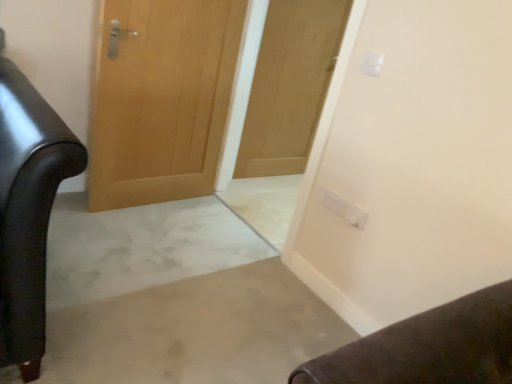
What do you see at coordinates (356, 217) in the screenshot?
I see `white plastic electric outlet at upper right, acting as the 2th electric outlet starting from the back` at bounding box center [356, 217].

Image resolution: width=512 pixels, height=384 pixels. What do you see at coordinates (372, 63) in the screenshot?
I see `white plastic electric outlet at upper center, marked as the third electric outlet in a bottom-to-top arrangement` at bounding box center [372, 63].

You are a GUI agent. You are given a task and a screenshot of the screen. Output one action in this format:
    pyautogui.click(x=<x>, y=<y>)
    Task: Click on the white plastic electric outlet at upper right, the 2th electric outlet in the bottom-to-top sequence
    
    Given the screenshot: What is the action you would take?
    pyautogui.click(x=334, y=203)

From the white plastic electric outlet at upper center, marked as the first electric outlet in a top-to-bottom arrangement, count the 1st door to the left and point to it. Please provide its 2D coordinates.

[(290, 85)]

Can you confirm if white plastic electric outlet at upper center, marked as the third electric outlet in a bottom-to-top arrangement, is smaller than wooden door at center, which is the second door in left-to-right order?

Yes.

Considering the positions of point (373, 69) and point (295, 127), is point (373, 69) closer or farther from the camera than point (295, 127)?

Point (373, 69).

From a real-world perspective, count 1st electric outlets downward from the wooden door at center, the first door from the right, and point to it. Please provide its 2D coordinates.

[(356, 217)]

Is white plastic electric outlet at upper right, marked as the third electric outlet in a top-to-bottom arrangement, beside wooden door at center, the first door from the right?

No, white plastic electric outlet at upper right, marked as the third electric outlet in a top-to-bottom arrangement, is not touching wooden door at center, the first door from the right.

Is white plastic electric outlet at upper center, marked as the third electric outlet in a bottom-to-top arrangement, completely or partially outside of wooden door at center, which is the 1th door in left-to-right order?

Indeed, white plastic electric outlet at upper center, marked as the third electric outlet in a bottom-to-top arrangement, is completely outside wooden door at center, which is the 1th door in left-to-right order.

From the white plastic electric outlet at upper center, marked as the third electric outlet in a bottom-to-top arrangement, count the 2nd door to the left and point to it. Please provide its 2D coordinates.

[(161, 99)]

Does white plastic electric outlet at upper center, placed as the 3th electric outlet when sorted from back to front, appear on the right side of wooden door at center, which is the 1th door in left-to-right order?

Yes.

Are white plastic electric outlet at upper center, placed as the 3th electric outlet when sorted from back to front, and wooden door at center, the second door positioned from the right, far apart?

Yes, white plastic electric outlet at upper center, placed as the 3th electric outlet when sorted from back to front, is far from wooden door at center, the second door positioned from the right.

Can you confirm if wooden door at center, which is the 1th door in left-to-right order, is shorter than white plastic electric outlet at upper right, arranged as the 2th electric outlet when viewed from the top?

In fact, wooden door at center, which is the 1th door in left-to-right order, may be taller than white plastic electric outlet at upper right, arranged as the 2th electric outlet when viewed from the top.

Does point (129, 171) lie in front of point (335, 210)?

No, (129, 171) is behind (335, 210).

In the scene shown: Would you say wooden door at center, which is the 1th door in left-to-right order, is a long distance from white plastic electric outlet at upper right, the 2th electric outlet in the bottom-to-top sequence?

That's right, there is a large distance between wooden door at center, which is the 1th door in left-to-right order, and white plastic electric outlet at upper right, the 2th electric outlet in the bottom-to-top sequence.

Is white plastic electric outlet at upper right, marked as the third electric outlet in a top-to-bottom arrangement, in front of or behind white plastic electric outlet at upper center, placed as the 3th electric outlet when sorted from back to front, in the image?

white plastic electric outlet at upper right, marked as the third electric outlet in a top-to-bottom arrangement, is positioned farther from the viewer than white plastic electric outlet at upper center, placed as the 3th electric outlet when sorted from back to front.

Can you confirm if white plastic electric outlet at upper right, acting as the 2th electric outlet starting from the back, is bigger than white plastic electric outlet at upper center, marked as the third electric outlet in a bottom-to-top arrangement?

Yes, white plastic electric outlet at upper right, acting as the 2th electric outlet starting from the back, is bigger than white plastic electric outlet at upper center, marked as the third electric outlet in a bottom-to-top arrangement.

How many degrees apart are the facing directions of white plastic electric outlet at upper right, marked as the third electric outlet in a top-to-bottom arrangement, and white plastic electric outlet at upper center, placed as the 3th electric outlet when sorted from back to front?

The facing directions of white plastic electric outlet at upper right, marked as the third electric outlet in a top-to-bottom arrangement, and white plastic electric outlet at upper center, placed as the 3th electric outlet when sorted from back to front, are 0.000571 degrees apart.

Locate an element on the screen. Image resolution: width=512 pixels, height=384 pixels. the 2nd electric outlet positioned above the white plastic electric outlet at upper right, acting as the 2th electric outlet starting from the back (from the image's perspective) is located at coordinates (372, 63).

Based on their positions, is white plastic electric outlet at upper right, acting as the 1th electric outlet starting from the back, located to the left or right of white plastic electric outlet at upper center, marked as the third electric outlet in a bottom-to-top arrangement?

Based on their positions, white plastic electric outlet at upper right, acting as the 1th electric outlet starting from the back, is located to the left of white plastic electric outlet at upper center, marked as the third electric outlet in a bottom-to-top arrangement.

Could you tell me if white plastic electric outlet at upper right, acting as the 1th electric outlet starting from the back, is facing white plastic electric outlet at upper center, marked as the third electric outlet in a bottom-to-top arrangement?

No, white plastic electric outlet at upper right, acting as the 1th electric outlet starting from the back, is not facing towards white plastic electric outlet at upper center, marked as the third electric outlet in a bottom-to-top arrangement.

Does point (330, 205) come farther from viewer compared to point (372, 53)?

Yes, point (330, 205) is farther from viewer.

Which is nearer, (338, 204) or (357, 207)?

Clearly, point (338, 204) is more distant from the camera than point (357, 207).

Between white plastic electric outlet at upper right, arranged as the 2th electric outlet when viewed from the top, and white plastic electric outlet at upper right, marked as the third electric outlet in a top-to-bottom arrangement, which one is positioned in front?

Positioned in front is white plastic electric outlet at upper right, marked as the third electric outlet in a top-to-bottom arrangement.

How far apart are white plastic electric outlet at upper right, arranged as the 2th electric outlet when viewed from the top, and white plastic electric outlet at upper right, marked as the third electric outlet in a top-to-bottom arrangement?

white plastic electric outlet at upper right, arranged as the 2th electric outlet when viewed from the top, and white plastic electric outlet at upper right, marked as the third electric outlet in a top-to-bottom arrangement, are 8.53 centimeters apart.

Considering the sizes of objects white plastic electric outlet at upper right, acting as the 1th electric outlet starting from the back, and white plastic electric outlet at upper right, acting as the 2th electric outlet starting from the back, in the image provided, who is shorter, white plastic electric outlet at upper right, acting as the 1th electric outlet starting from the back, or white plastic electric outlet at upper right, acting as the 2th electric outlet starting from the back,?

white plastic electric outlet at upper right, acting as the 2th electric outlet starting from the back.

At what (x,y) coordinates should I click in order to perform the action: click on the 1st door to the left of the white plastic electric outlet at upper center, the first electric outlet in the front-to-back sequence, counting from the anchor's position. Please return your answer as a coordinate pair (x, y). The image size is (512, 384). Looking at the image, I should click on (290, 85).

At what (x,y) coordinates should I click in order to perform the action: click on the 2nd door positioned above the white plastic electric outlet at upper right, the 1th electric outlet when ordered from bottom to top (from the image's perspective). Please return your answer as a coordinate pair (x, y). The image size is (512, 384). Looking at the image, I should click on (290, 85).

From the image, which object appears to be farther from wooden door at center, the first door from the right, white plastic electric outlet at upper center, placed as the 3th electric outlet when sorted from back to front, or white plastic electric outlet at upper right, arranged as the third electric outlet when viewed from the front?

The object further to wooden door at center, the first door from the right, is white plastic electric outlet at upper center, placed as the 3th electric outlet when sorted from back to front.

Considering their positions, is white plastic electric outlet at upper right, the 2th electric outlet in the bottom-to-top sequence, positioned further to wooden door at center, the second door positioned from the right, than white plastic electric outlet at upper right, positioned as the 2th electric outlet in front-to-back order?

white plastic electric outlet at upper right, positioned as the 2th electric outlet in front-to-back order.

Based on their spatial positions, is wooden door at center, the first door from the right, or white plastic electric outlet at upper right, arranged as the 2th electric outlet when viewed from the top, further from white plastic electric outlet at upper center, marked as the first electric outlet in a top-to-bottom arrangement?

wooden door at center, the first door from the right, is positioned further to the anchor white plastic electric outlet at upper center, marked as the first electric outlet in a top-to-bottom arrangement.

When comparing their distances from wooden door at center, which is the second door in left-to-right order, does white plastic electric outlet at upper right, the 2th electric outlet in the bottom-to-top sequence, or white plastic electric outlet at upper right, acting as the 2th electric outlet starting from the back, seem closer?

white plastic electric outlet at upper right, the 2th electric outlet in the bottom-to-top sequence, lies closer to wooden door at center, which is the second door in left-to-right order, than the other object.

Based on their spatial positions, is white plastic electric outlet at upper center, the first electric outlet in the front-to-back sequence, or wooden door at center, which is the 1th door in left-to-right order, further from wooden door at center, which is the second door in left-to-right order?

The object further to wooden door at center, which is the second door in left-to-right order, is white plastic electric outlet at upper center, the first electric outlet in the front-to-back sequence.

Based on the photo, when comparing their distances from white plastic electric outlet at upper right, arranged as the third electric outlet when viewed from the front, does white plastic electric outlet at upper right, the 1th electric outlet when ordered from bottom to top, or wooden door at center, the first door from the right, seem further?

wooden door at center, the first door from the right, is further to white plastic electric outlet at upper right, arranged as the third electric outlet when viewed from the front.

Based on their spatial positions, is wooden door at center, the second door positioned from the right, or white plastic electric outlet at upper center, marked as the third electric outlet in a bottom-to-top arrangement, closer to white plastic electric outlet at upper right, acting as the 1th electric outlet starting from the back?

white plastic electric outlet at upper center, marked as the third electric outlet in a bottom-to-top arrangement, is closer to white plastic electric outlet at upper right, acting as the 1th electric outlet starting from the back.

Estimate the real-world distances between objects in this image. Which object is further from white plastic electric outlet at upper right, the 1th electric outlet when ordered from bottom to top, wooden door at center, which is the second door in left-to-right order, or wooden door at center, which is the 1th door in left-to-right order?

Based on the image, wooden door at center, which is the second door in left-to-right order, appears to be further to white plastic electric outlet at upper right, the 1th electric outlet when ordered from bottom to top.

Where is `door between wooden door at center, the second door positioned from the right, and white plastic electric outlet at upper right, acting as the 1th electric outlet starting from the back, in the horizontal direction`? The image size is (512, 384). door between wooden door at center, the second door positioned from the right, and white plastic electric outlet at upper right, acting as the 1th electric outlet starting from the back, in the horizontal direction is located at coordinates (290, 85).

Where is `door between wooden door at center, the second door positioned from the right, and white plastic electric outlet at upper right, marked as the third electric outlet in a top-to-bottom arrangement`? The image size is (512, 384). door between wooden door at center, the second door positioned from the right, and white plastic electric outlet at upper right, marked as the third electric outlet in a top-to-bottom arrangement is located at coordinates (290, 85).

Locate an element on the screen. The height and width of the screenshot is (384, 512). door between wooden door at center, which is the 1th door in left-to-right order, and white plastic electric outlet at upper center, the first electric outlet in the front-to-back sequence, from left to right is located at coordinates (290, 85).

The height and width of the screenshot is (384, 512). I want to click on electric outlet between wooden door at center, which is the 1th door in left-to-right order, and white plastic electric outlet at upper right, marked as the third electric outlet in a top-to-bottom arrangement, in the horizontal direction, so click(334, 203).